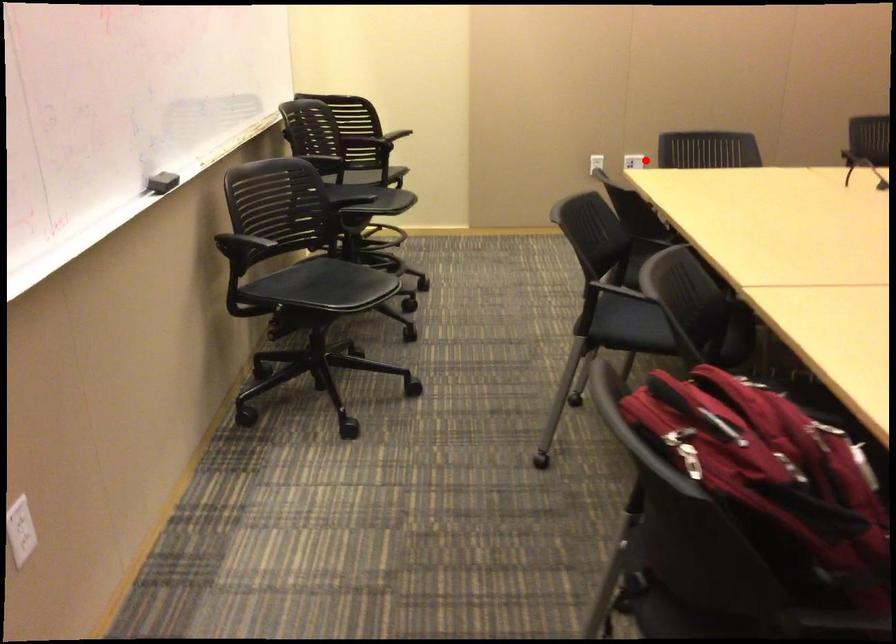
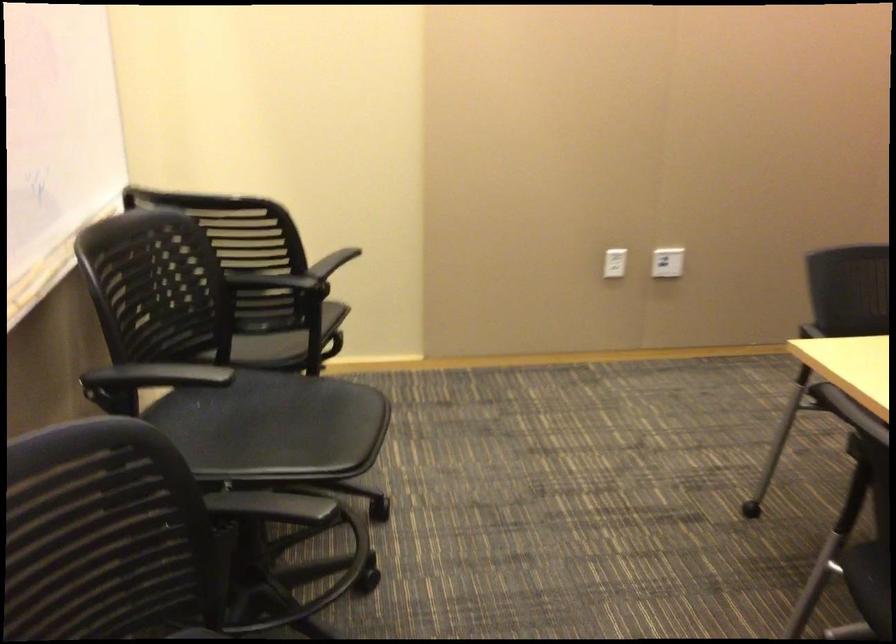
Where in the second image is the point corresponding to the highlighted location from the first image?

(667, 261)